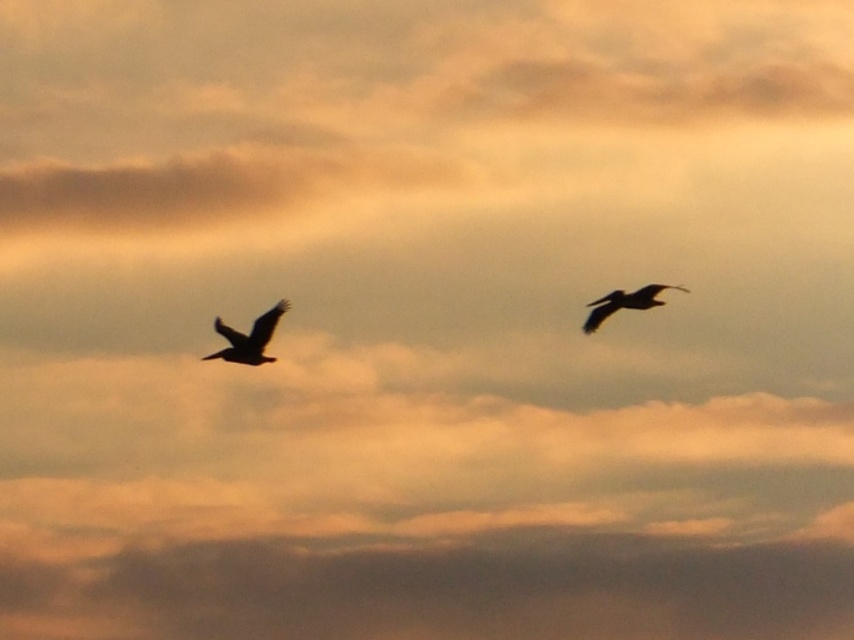
You are a photographer trying to capture the silhouette feathered bird at left in your shot. Your camera has a focus point at coordinates 0.5, 0.3. Will the focus point successfully capture the bird?

The silhouette feathered bird at left is located at point (249, 337). The camera focus point is at (255, 320). The distance between them is sqrt of squared differences, which is sqrt of 0.028 squared plus 0.007 squared. That equals sqrt of 0.000784 plus 0.000049, so sqrt of 0.000833. That is approximately 0.0288. Since this is within the camera focus tolerance, the focus point will successfully capture the silhouette feathered bird at left.

Consider the image. You are an ornithologist observing two birds in flight. You notice the silhouette feathered bird at left and the dark feathered bird at upper right. Which bird has a smaller wingspan based on their visual appearance in the image?

The silhouette feathered bird at left has a lesser width compared to the dark feathered bird at upper right, so it has a smaller wingspan.

You are a birdwatcher trying to identify two birds in the sky. You notice a silhouette feathered bird at left and a dark feathered bird at upper right. Which bird has a larger size?

The silhouette feathered bird at left is bigger than the dark feathered bird at upper right.